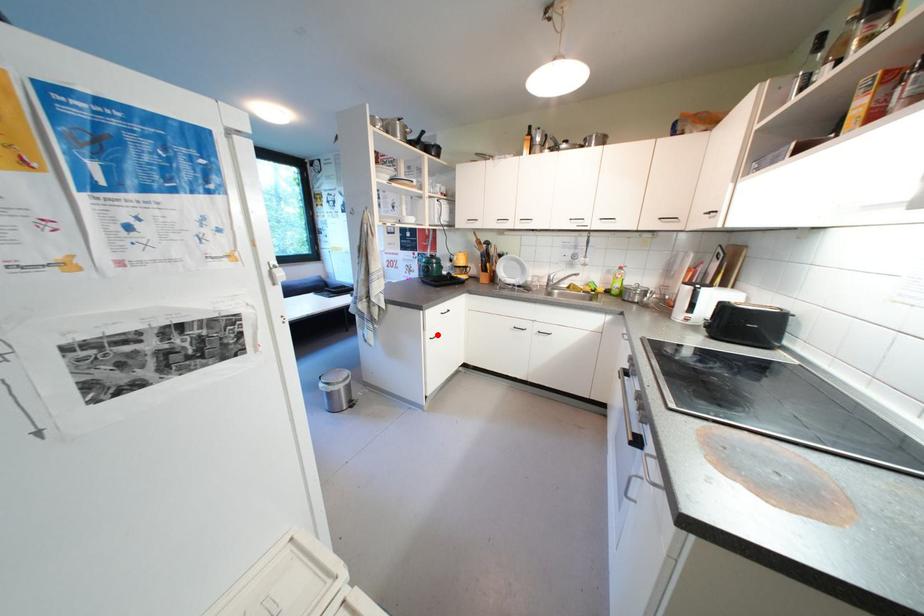
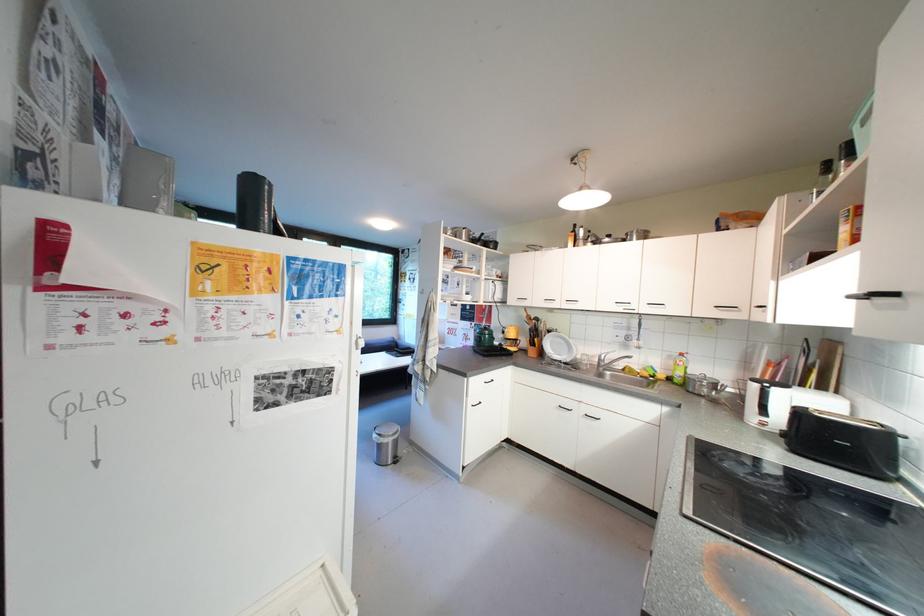
The point at the highlighted location is marked in the first image. Where is the corresponding point in the second image?

(480, 402)